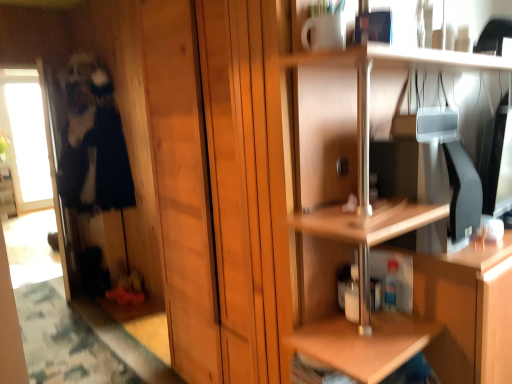
Question: From a real-world perspective, is dark blue fabric at left positioned above or below transparent glass screen door at left?

Choices:
 (A) above
 (B) below

Answer: (A)

Question: Is dark blue fabric at left bigger or smaller than transparent glass screen door at left?

Choices:
 (A) small
 (B) big

Answer: (B)

Question: Estimate the real-world distances between objects in this image. Which object is closer to the transparent glass screen door at left?

Choices:
 (A) dark blue fabric at left
 (B) wooden shelf at upper right

Answer: (A)

Question: Estimate the real-world distances between objects in this image. Which object is closer to the dark blue fabric at left?

Choices:
 (A) transparent glass screen door at left
 (B) wooden shelf at upper right

Answer: (A)